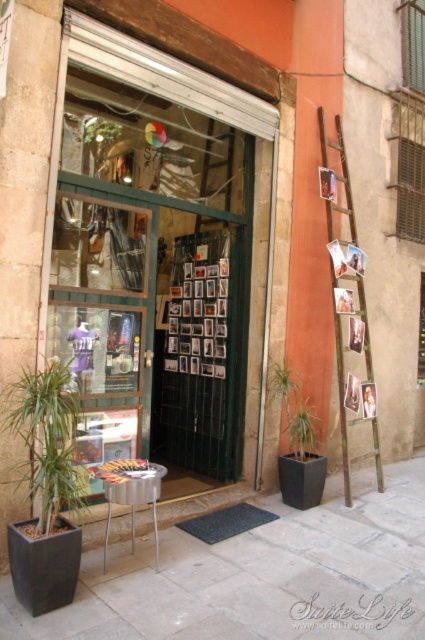
You are standing at the entrance of the shop and want to place a new green leafy plant exactly at the center of the entrance area. According to the current layout, is the existing green leafy plant at center already occupying that spot?

The green leafy plant at center is positioned at point (292,410), which is the exact center coordinates of the entrance area. Therefore, the existing green leafy plant at center is already occupying the desired spot.

You are a delivery person trying to enter the shop through the transparent glass door at center. Can you step onto the smooth stone pavement at center to reach the door?

The smooth stone pavement at center is behind the transparent glass door at center, so you cannot step onto it to reach the door. The door is in front of the pavement, so you need to approach the transparent glass door at center from the outside first.

You are a delivery person trying to enter the shop. You have a large package that is 2 meters wide. Can you fit the package through the transparent glass door at center without bending it? Mention the green leafy plant at center in your answer.

The transparent glass door at center is larger than the green leafy plant at center. Since the door is bigger, it should be wide enough to allow a 2 meter wide package to pass through without needing to bend it.